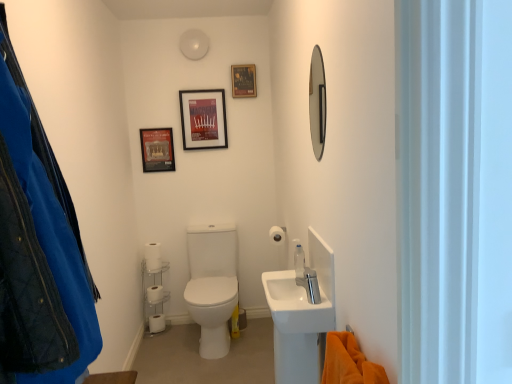
Find the location of a particular element. The height and width of the screenshot is (384, 512). white matte toilet paper at lower left, which is counted as the 4th toilet paper, starting from the top is located at coordinates (157, 323).

The height and width of the screenshot is (384, 512). What do you see at coordinates (317, 102) in the screenshot?
I see `shiny silver mirror at upper right` at bounding box center [317, 102].

The height and width of the screenshot is (384, 512). Describe the element at coordinates (155, 294) in the screenshot. I see `white matte toilet paper at lower left, marked as the 3th toilet paper in a top-to-bottom arrangement` at that location.

Identify the location of matte plastic picture frame at upper center, placed as the 2th picture frame when sorted from right to left. (203, 119).

Is matte black picture frame at upper left, which is the 1th picture frame from left to right, aimed at white matte toilet paper at lower left, placed as the fourth toilet paper when sorted from right to left?

No, matte black picture frame at upper left, which is the 1th picture frame from left to right, is not facing towards white matte toilet paper at lower left, placed as the fourth toilet paper when sorted from right to left.

Considering the relative sizes of matte black picture frame at upper left, placed as the 3th picture frame when sorted from right to left, and white matte toilet paper at lower left, marked as the 3th toilet paper in a top-to-bottom arrangement, in the image provided, is matte black picture frame at upper left, placed as the 3th picture frame when sorted from right to left, thinner than white matte toilet paper at lower left, marked as the 3th toilet paper in a top-to-bottom arrangement,?

Yes, matte black picture frame at upper left, placed as the 3th picture frame when sorted from right to left, is thinner than white matte toilet paper at lower left, marked as the 3th toilet paper in a top-to-bottom arrangement.

From the image's perspective, is matte black picture frame at upper left, placed as the 3th picture frame when sorted from right to left, above or below white matte toilet paper at lower left, placed as the fourth toilet paper when sorted from right to left?

From the image's perspective, matte black picture frame at upper left, placed as the 3th picture frame when sorted from right to left, appears above white matte toilet paper at lower left, placed as the fourth toilet paper when sorted from right to left.

Are matte black picture frame at upper left, which is the 1th picture frame from left to right, and white matte toilet paper at lower left, placed as the fourth toilet paper when sorted from right to left, making contact?

No, matte black picture frame at upper left, which is the 1th picture frame from left to right, is not with white matte toilet paper at lower left, placed as the fourth toilet paper when sorted from right to left.

Can you confirm if white matte toilet paper at lower left, which is counted as the 2th toilet paper, starting from the bottom, is shorter than white matte toilet paper at center, the first toilet paper in the right-to-left sequence?

Incorrect, the height of white matte toilet paper at lower left, which is counted as the 2th toilet paper, starting from the bottom, does not fall short of that of white matte toilet paper at center, the first toilet paper in the right-to-left sequence.

Is white matte toilet paper at lower left, which is counted as the 2th toilet paper, starting from the bottom, oriented away from white matte toilet paper at center, the first toilet paper in the right-to-left sequence?

No, white matte toilet paper at lower left, which is counted as the 2th toilet paper, starting from the bottom, is not facing the opposite direction of white matte toilet paper at center, the first toilet paper in the right-to-left sequence.

How much distance is there between white matte toilet paper at lower left, marked as the second toilet paper in a back-to-front arrangement, and white matte toilet paper at center, which is the fourth toilet paper in bottom-to-top order?

They are 38.28 inches apart.

Can you confirm if white matte toilet paper at lower left, marked as the second toilet paper in a back-to-front arrangement, is bigger than white matte toilet paper at center, which ranks as the first toilet paper in top-to-bottom order?

Yes.

Which is behind, white matte toilet paper at lower left, positioned as the second toilet paper in left-to-right order, or white plastic shelf at lower left?

white matte toilet paper at lower left, positioned as the second toilet paper in left-to-right order.

In order to click on shelf below the white matte toilet paper at lower left, which ranks as the third toilet paper in bottom-to-top order (from the image's perspective) in this screenshot , I will do `click(154, 299)`.

Measure the distance from white matte toilet paper at lower left, acting as the third toilet paper starting from the right, to white plastic shelf at lower left.

They are 7.16 inches apart.

From the picture: From the image's perspective, which object appears higher, white matte toilet paper at lower left, the second toilet paper positioned from the top, or white plastic shelf at lower left?

white matte toilet paper at lower left, the second toilet paper positioned from the top, appears higher in the image.

Considering the positions of points (237, 80) and (154, 295), is point (237, 80) closer to camera compared to point (154, 295)?

Yes.

From a real-world perspective, is metallic poster at upper center, the 1th picture frame when ordered from right to left, above or below white matte toilet paper at lower left, marked as the second toilet paper in a back-to-front arrangement?

In terms of real-world spatial position, metallic poster at upper center, the 1th picture frame when ordered from right to left, is above white matte toilet paper at lower left, marked as the second toilet paper in a back-to-front arrangement.

Could you tell me if metallic poster at upper center, positioned as the third picture frame in left-to-right order, is facing white matte toilet paper at lower left, marked as the second toilet paper in a back-to-front arrangement?

No, metallic poster at upper center, positioned as the third picture frame in left-to-right order, is not facing towards white matte toilet paper at lower left, marked as the second toilet paper in a back-to-front arrangement.

Considering the sizes of objects metallic poster at upper center, the 1th picture frame when ordered from right to left, and white matte toilet paper at lower left, which appears as the 3th toilet paper when viewed from the front, in the image provided, who is taller, metallic poster at upper center, the 1th picture frame when ordered from right to left, or white matte toilet paper at lower left, which appears as the 3th toilet paper when viewed from the front,?

metallic poster at upper center, the 1th picture frame when ordered from right to left, is taller.

Is point (241, 78) farther from camera compared to point (190, 143)?

No, it is in front of (190, 143).

Consider the image. Which of these two, metallic poster at upper center, positioned as the third picture frame in left-to-right order, or matte plastic picture frame at upper center, placed as the 2th picture frame when sorted from right to left, stands taller?

With more height is matte plastic picture frame at upper center, placed as the 2th picture frame when sorted from right to left.

From the image's perspective, is metallic poster at upper center, positioned as the third picture frame in left-to-right order, below matte plastic picture frame at upper center, the second picture frame positioned from the left?

No, from the image's perspective, metallic poster at upper center, positioned as the third picture frame in left-to-right order, is not below matte plastic picture frame at upper center, the second picture frame positioned from the left.

Which is correct: metallic poster at upper center, the 1th picture frame when ordered from right to left, is inside matte plastic picture frame at upper center, the second picture frame positioned from the left, or outside of it?

metallic poster at upper center, the 1th picture frame when ordered from right to left, cannot be found inside matte plastic picture frame at upper center, the second picture frame positioned from the left.

Which of these two, white matte toilet paper at lower left, positioned as the first toilet paper in bottom-to-top order, or clear plastic soap dispenser at upper center, stands taller?

With more height is clear plastic soap dispenser at upper center.

From the image's perspective, which is above, white matte toilet paper at lower left, positioned as the first toilet paper in bottom-to-top order, or clear plastic soap dispenser at upper center?

clear plastic soap dispenser at upper center, from the image's perspective.

Which of these two, white matte toilet paper at lower left, which is counted as the 4th toilet paper, starting from the top, or clear plastic soap dispenser at upper center, is thinner?

With smaller width is clear plastic soap dispenser at upper center.

Which is in front, point (314, 300) or point (313, 112)?

The point (314, 300) is more forward.

Is satin nickel faucet at sink right not within shiny silver mirror at upper right?

That's correct, satin nickel faucet at sink right is outside of shiny silver mirror at upper right.

From a real-world perspective, who is located higher, satin nickel faucet at sink right or shiny silver mirror at upper right?

From a 3D spatial view, shiny silver mirror at upper right is above.

Is satin nickel faucet at sink right thinner than shiny silver mirror at upper right?

In fact, satin nickel faucet at sink right might be wider than shiny silver mirror at upper right.

Identify the location of picture frame that is the 1st one when counting upward from the white matte toilet paper at lower left, placed as the fourth toilet paper when sorted from right to left (from the image's perspective). The height and width of the screenshot is (384, 512). (157, 149).

You are a GUI agent. You are given a task and a screenshot of the screen. Output one action in this format:
    pyautogui.click(x=<x>, y=<y>)
    Task: Click on the 3rd toilet paper counting from the right side of the white matte toilet paper at lower left, marked as the 3th toilet paper in a top-to-bottom arrangement
    
    Given the screenshot: What is the action you would take?
    277,236

From the image, which object appears to be nearer to matte plastic picture frame at upper center, placed as the 2th picture frame when sorted from right to left, white matte toilet paper at center, positioned as the 1th toilet paper in front-to-back order, or white matte toilet paper at lower left, marked as the second toilet paper in a back-to-front arrangement?

white matte toilet paper at center, positioned as the 1th toilet paper in front-to-back order.

Based on their spatial positions, is shiny silver mirror at upper right or matte black picture frame at upper left, placed as the 3th picture frame when sorted from right to left, closer to satin nickel faucet at sink right?

Among the two, shiny silver mirror at upper right is located nearer to satin nickel faucet at sink right.

Based on their spatial positions, is matte plastic picture frame at upper center, the second picture frame positioned from the left, or white matte toilet paper at lower left, placed as the third toilet paper when sorted from left to right, closer to white matte toilet paper at center, placed as the fourth toilet paper when sorted from back to front?

matte plastic picture frame at upper center, the second picture frame positioned from the left, lies closer to white matte toilet paper at center, placed as the fourth toilet paper when sorted from back to front, than the other object.

Which object lies nearer to the anchor point matte plastic picture frame at upper center, the second picture frame positioned from the left, satin nickel faucet at sink right or white matte toilet paper at lower left, the third toilet paper in the back-to-front sequence?

white matte toilet paper at lower left, the third toilet paper in the back-to-front sequence, is closer to matte plastic picture frame at upper center, the second picture frame positioned from the left.

Looking at the image, which one is located closer to white matte toilet paper at lower left, marked as the 3th toilet paper in a top-to-bottom arrangement, white matte toilet paper at lower left, the second toilet paper positioned from the top, or satin nickel faucet at sink right?

Among the two, white matte toilet paper at lower left, the second toilet paper positioned from the top, is located nearer to white matte toilet paper at lower left, marked as the 3th toilet paper in a top-to-bottom arrangement.

From the image, which object appears to be farther from white matte toilet paper at lower left, the second toilet paper positioned from the top, white matte toilet paper at lower left, which is counted as the 2th toilet paper, starting from the bottom, or shiny silver mirror at upper right?

shiny silver mirror at upper right.

Considering their positions, is matte plastic picture frame at upper center, placed as the 2th picture frame when sorted from right to left, positioned further to white matte toilet paper at center, the fourth toilet paper from the left, than matte black picture frame at upper left, which is the 1th picture frame from left to right?

Among the two, matte black picture frame at upper left, which is the 1th picture frame from left to right, is located further to white matte toilet paper at center, the fourth toilet paper from the left.

From the picture: Based on their spatial positions, is white plastic shelf at lower left or clear plastic soap dispenser at upper center further from satin nickel faucet at sink right?

white plastic shelf at lower left is positioned further to the anchor satin nickel faucet at sink right.

The width and height of the screenshot is (512, 384). Identify the location of shelf between shiny silver mirror at upper right and matte black picture frame at upper left, which is the 1th picture frame from left to right, along the z-axis. (154, 299).

Where is `toilet paper between white matte toilet paper at lower left, positioned as the second toilet paper in left-to-right order, and white matte toilet paper at center, which ranks as the first toilet paper in top-to-bottom order`? This screenshot has width=512, height=384. toilet paper between white matte toilet paper at lower left, positioned as the second toilet paper in left-to-right order, and white matte toilet paper at center, which ranks as the first toilet paper in top-to-bottom order is located at coordinates (157, 323).

Where is `tap located between orange plush towel at lower right and metallic poster at upper center, positioned as the third picture frame in left-to-right order, in the depth direction`? tap located between orange plush towel at lower right and metallic poster at upper center, positioned as the third picture frame in left-to-right order, in the depth direction is located at coordinates (310, 285).

Where is `tap between shiny silver mirror at upper right and white matte toilet paper at lower left, which appears as the second toilet paper when viewed from the front, from front to back`? The image size is (512, 384). tap between shiny silver mirror at upper right and white matte toilet paper at lower left, which appears as the second toilet paper when viewed from the front, from front to back is located at coordinates (310, 285).